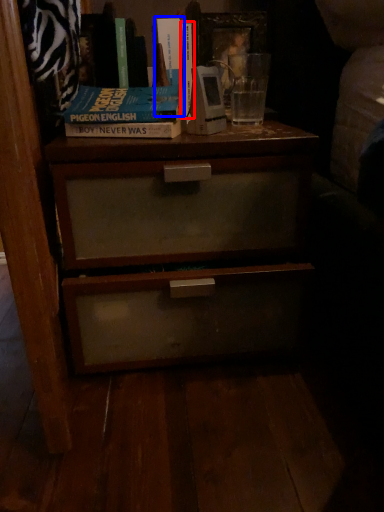
Question: Which of the following is the closest to the observer, book (highlighted by a red box) or book (highlighted by a blue box)?

Choices:
 (A) book
 (B) book

Answer: (B)